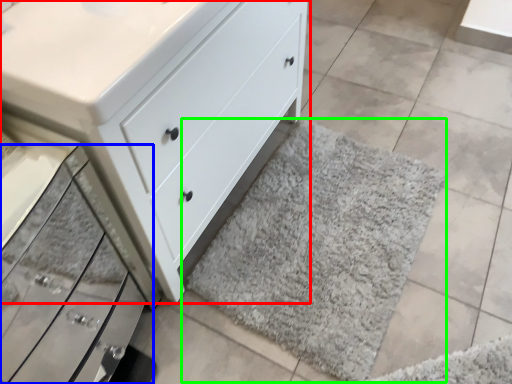
Question: Which object is the farthest from chest of drawers (highlighted by a red box)? Choose among these: drawer (highlighted by a blue box) or bath mat (highlighted by a green box).

Choices:
 (A) drawer
 (B) bath mat

Answer: (B)